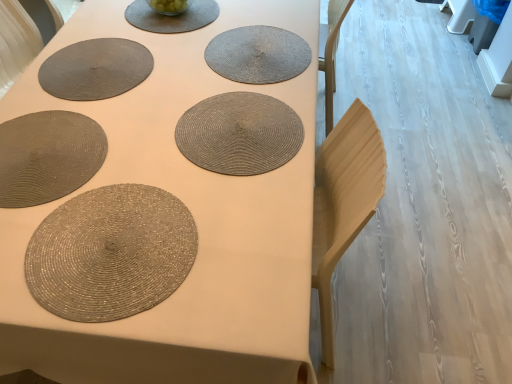
The height and width of the screenshot is (384, 512). In order to click on empty space that is to the right of shiny metallic placemat at bottom left, which is the first paper plate in front-to-back order in this screenshot , I will do `click(243, 251)`.